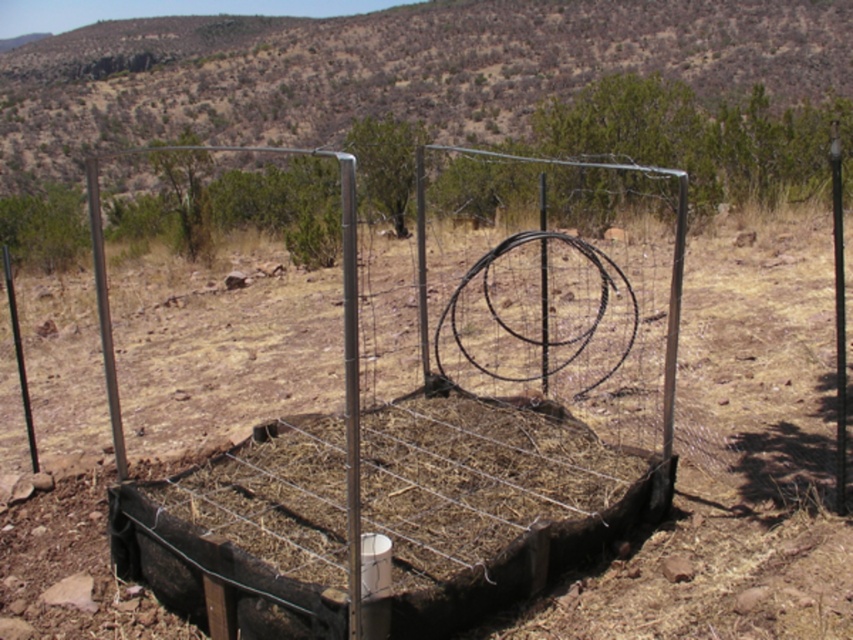
You are standing in the fenced garden bed and want to look at the metallic pole at left. Do you need to move past the metal wire fence at center to see it?

The metal wire fence at center is in front of the metallic pole at left, so you would need to move past the metal wire fence at center to see the metallic pole at left.